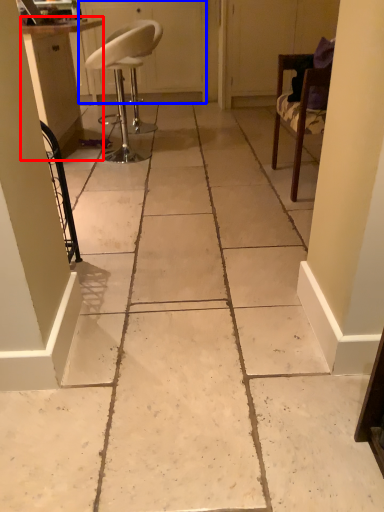
Question: Which object appears farthest to the camera in this image, cabinetry (highlighted by a red box) or screen door (highlighted by a blue box)?

Choices:
 (A) cabinetry
 (B) screen door

Answer: (B)